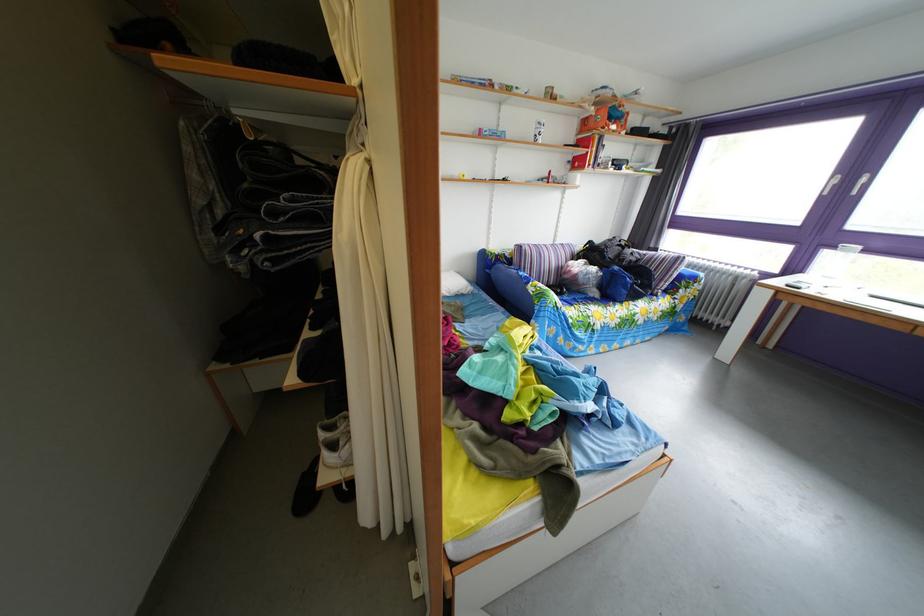
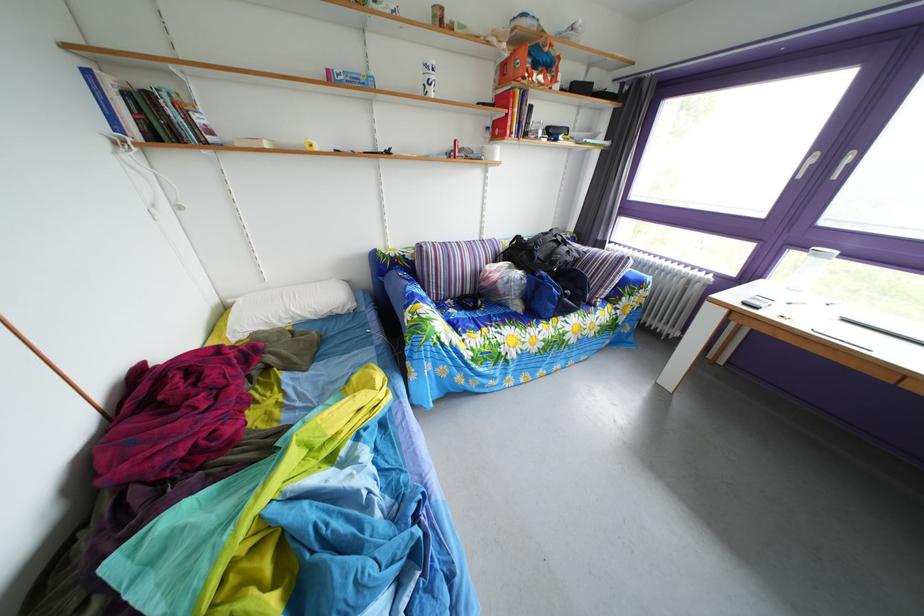
In the second image, find the point that corresponds to pixel 602 262 in the first image.

(529, 261)